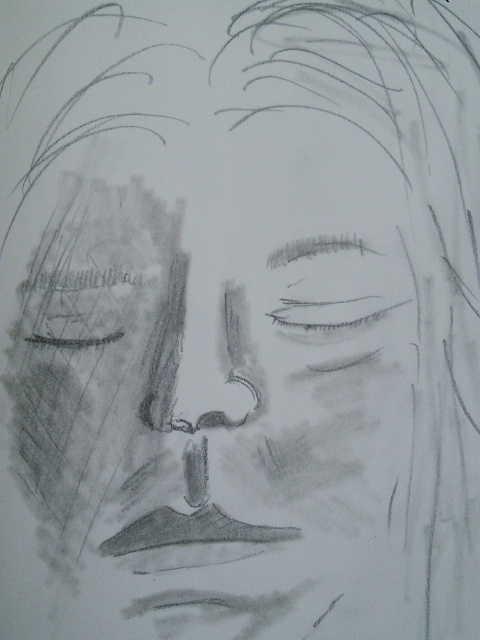
You are an artist trying to replicate this sketch. You want to place a highlight on the smooth gray eye at center. According to the sketch, where should you place the highlight relative to the eye?

The highlight should be placed at the position corresponding to point (x=330, y=314) on the smooth gray eye at center, as that is where the eye is located in the sketch.

From the picture: You are an art student analyzing the pencil sketch of a face. You notice the gray pencil sketch of nose at center and the smooth gray eye at center. Which object is positioned more to the left?

The gray pencil sketch of nose at center is positioned more to the left compared to the smooth gray eye at center.

You are an art student analyzing the pencil sketch of a face. You notice two versions of the nose depicted as the gray pencil sketch of nose at center and the smooth gray nose at center. Which nose appears layered on top of the other in the drawing?

The gray pencil sketch of nose at center is positioned over smooth gray nose at center, so the gray pencil sketch of nose at center appears layered on top.